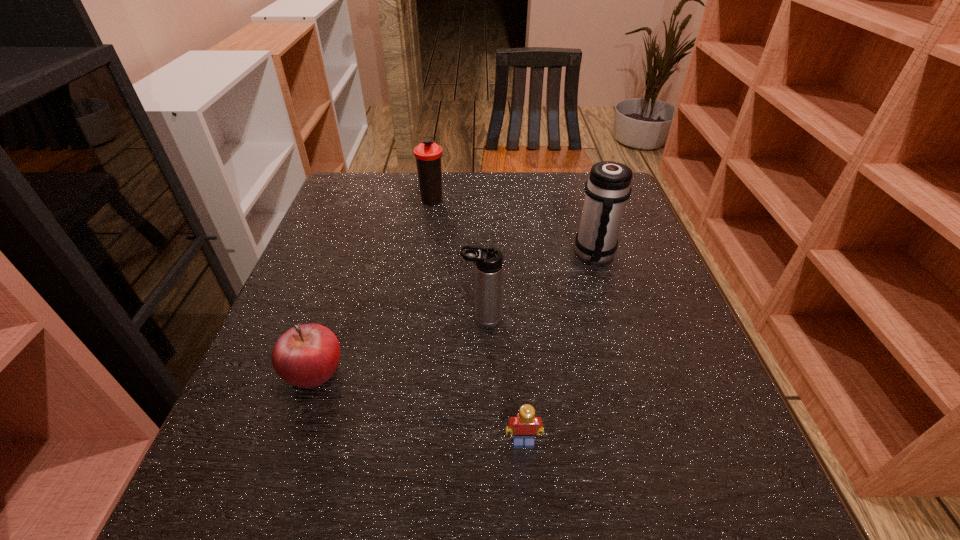
Locate an element on the screen. The height and width of the screenshot is (540, 960). unoccupied position between the Lego and the second nearest object is located at coordinates (419, 406).

At what (x,y) coordinates should I click in order to perform the action: click on free space between the apple and the farthest thermos bottle. Please return your answer as a coordinate pair (x, y). Looking at the image, I should click on (373, 285).

Where is `free space between the second thermos bottle from left to right and the leftmost thermos bottle`? free space between the second thermos bottle from left to right and the leftmost thermos bottle is located at coordinates (458, 260).

Where is `free space that is in between the second thermos bottle from left to right and the rightmost object`? The image size is (960, 540). free space that is in between the second thermos bottle from left to right and the rightmost object is located at coordinates (539, 287).

This screenshot has width=960, height=540. In order to click on vacant region between the leftmost object and the nearest thermos bottle in this screenshot , I will do `click(397, 345)`.

Identify the location of object that ranks as the third closest to the farthest object. This screenshot has width=960, height=540. (306, 356).

Locate an element on the screen. object that ranks as the third closest to the fourth farthest object is located at coordinates (428, 154).

Identify which thermos bottle is located as the nearest to the nearest thermos bottle. Please provide its 2D coordinates. Your answer should be formatted as a tuple, i.e. [(x, y)], where the tuple contains the x and y coordinates of a point satisfying the conditions above.

[(608, 187)]

In order to click on thermos bottle that is the second nearest to the tallest thermos bottle in this screenshot , I will do `click(428, 154)`.

Identify the location of vacant space that satisfies the following two spatial constraints: 1. on the side with the handle of the rightmost object; 2. on the handle side of the second thermos bottle from left to right. (614, 320).